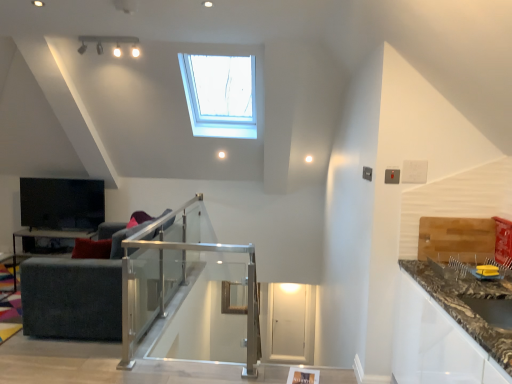
Question: From the image's perspective, is clear glass balustrade at center positioned above or below transparent glass door at center?

Choices:
 (A) below
 (B) above

Answer: (B)

Question: Would you say clear glass balustrade at center is to the left or to the right of transparent glass door at center in the picture?

Choices:
 (A) left
 (B) right

Answer: (A)

Question: Estimate the real-world distances between objects in this image. Which object is farther from the clear glass balustrade at center?

Choices:
 (A) matte black table at lower left
 (B) transparent glass door at center
 (C) marble-patterned countertop at lower right
 (D) dark gray fabric couch at left

Answer: (A)

Question: Which of these objects is positioned farthest from the dark gray fabric couch at left?

Choices:
 (A) transparent glass door at center
 (B) marble-patterned countertop at lower right
 (C) clear glass balustrade at center
 (D) matte black table at lower left

Answer: (A)